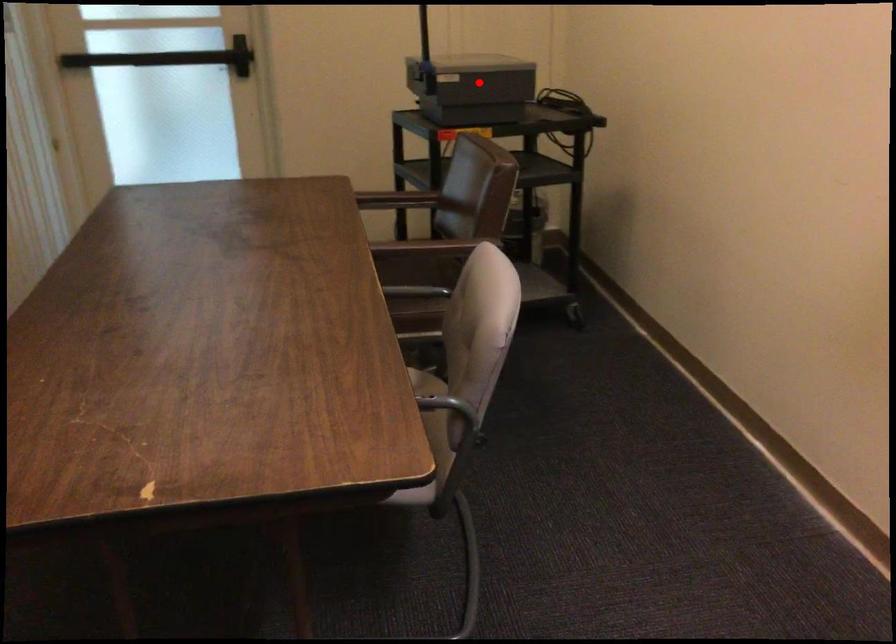
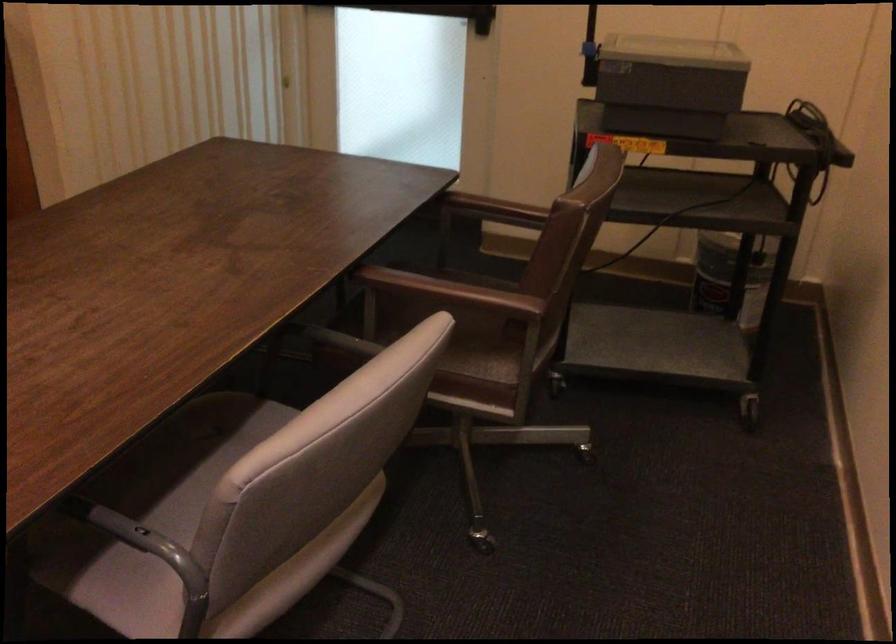
Find the pixel in the second image that matches the highlighted location in the first image.

(668, 84)